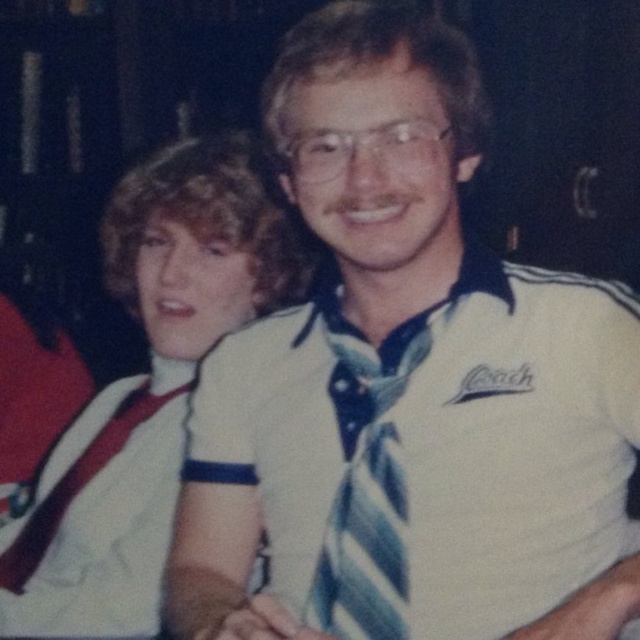
You are taking a photo of two people standing in front of you. You notice two points on their clothing marked as point 1 at coordinates (200, 346) and point 2 at coordinates (312, 579). Which point is closer to your camera?

Point 1 at coordinates (200, 346) is closer to the camera than point 2 at coordinates (312, 579) because it is further to the camera than the other point.

You are a photographer adjusting the focus of your camera. You need to focus on either the white fabric shirt at upper left or the blue striped tie at center. Which object should you focus on first if you want to ensure the closest object is sharp?

The white fabric shirt at upper left is closer to the viewer than the blue striped tie at center, so you should focus on the white fabric shirt at upper left first to ensure the closest object is sharp.